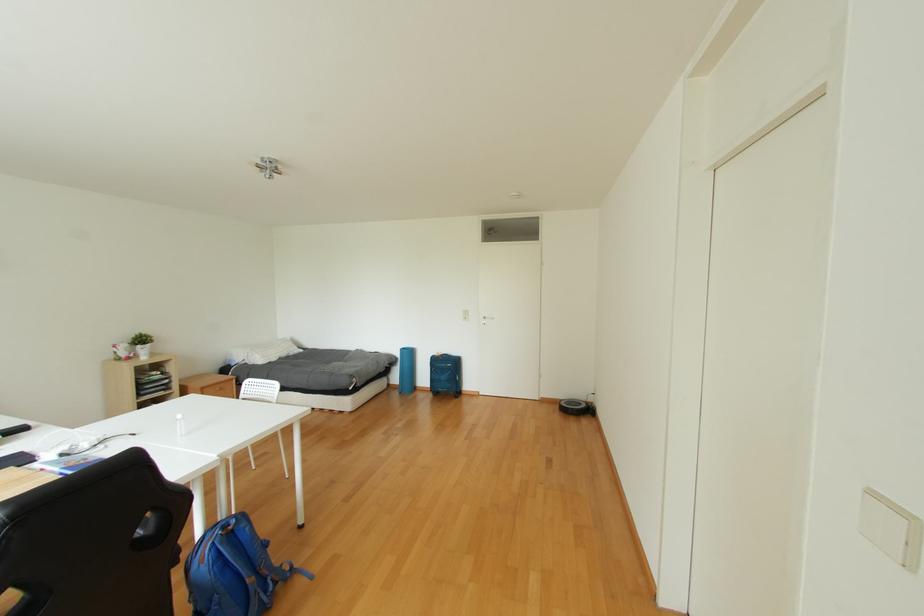
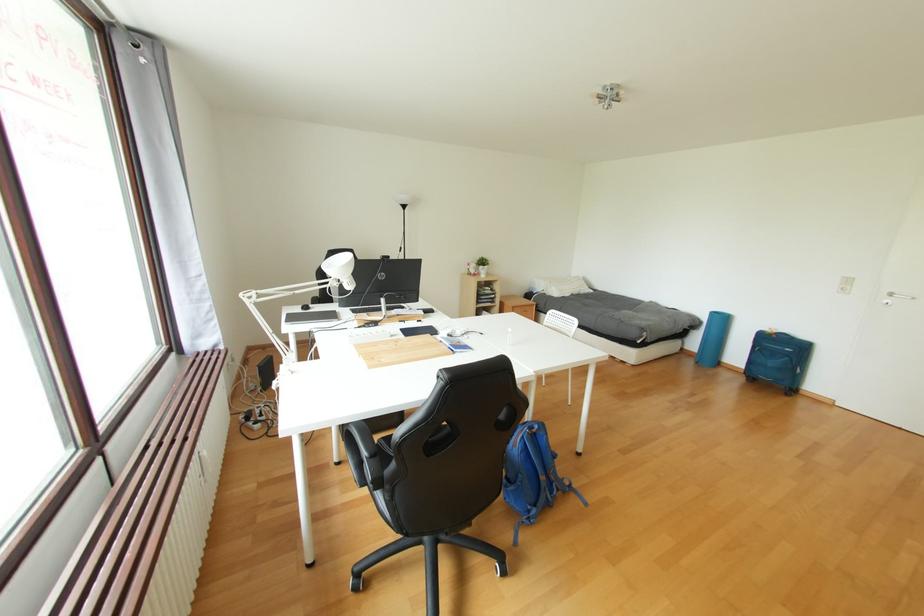
Question: The camera is either moving clockwise (left) or counter-clockwise (right) around the object. The first image is from the beginning of the video and the second image is from the end. Is the camera moving left or right when shooting the video?

Choices:
 (A) Left
 (B) Right

Answer: (B)